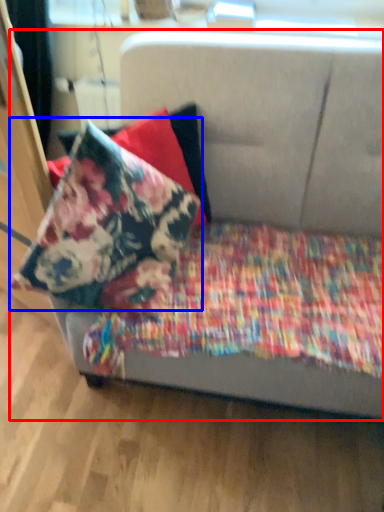
Question: Which object appears farthest to the camera in this image, studio couch (highlighted by a red box) or pillow (highlighted by a blue box)?

Choices:
 (A) studio couch
 (B) pillow

Answer: (B)